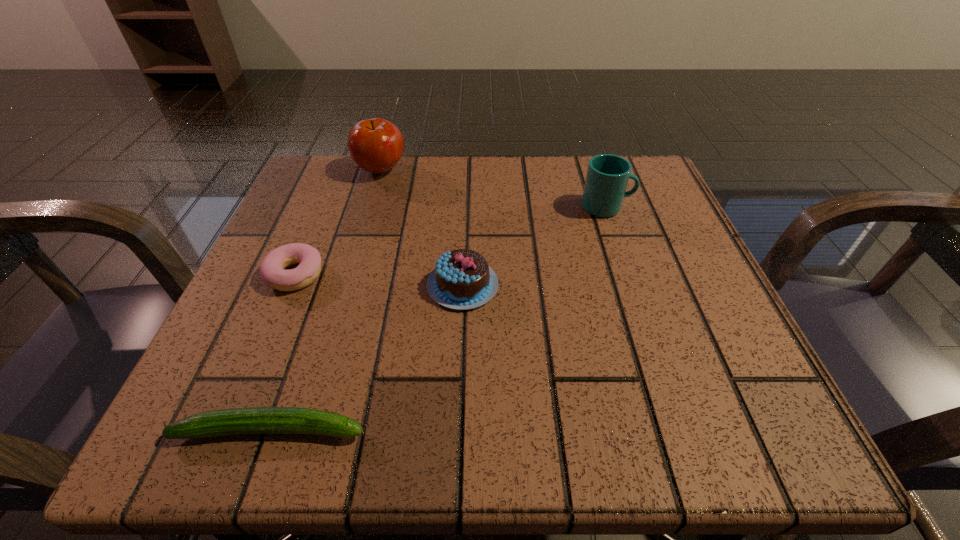
You are a GUI agent. You are given a task and a screenshot of the screen. Output one action in this format:
    pyautogui.click(x=<x>, y=<y>)
    Task: Click on the vacant space situated 0.080m on the handle side of the fourth shortest object
    The height and width of the screenshot is (540, 960).
    Given the screenshot: What is the action you would take?
    pyautogui.click(x=674, y=207)

Image resolution: width=960 pixels, height=540 pixels. I want to click on vacant space located on the right of the third shortest object, so 541,285.

Locate an element on the screen. The image size is (960, 540). free location located 0.100m on the back of the doughnut is located at coordinates (318, 220).

At what (x,y) coordinates should I click in order to perform the action: click on vacant space situated on the front-facing side of the nearest object. Please return your answer as a coordinate pair (x, y). The image size is (960, 540). Looking at the image, I should click on tap(628, 430).

The image size is (960, 540). Identify the location of apple at the far edge. pyautogui.click(x=376, y=145).

At what (x,y) coordinates should I click in order to perform the action: click on cup situated at the far edge. Please return your answer as a coordinate pair (x, y). The width and height of the screenshot is (960, 540). Looking at the image, I should click on (607, 176).

At what (x,y) coordinates should I click in order to perform the action: click on object situated at the near edge. Please return your answer as a coordinate pair (x, y). This screenshot has height=540, width=960. Looking at the image, I should click on (255, 420).

Locate an element on the screen. apple that is at the left edge is located at coordinates (376, 145).

The image size is (960, 540). Find the location of `doughnut present at the left edge`. doughnut present at the left edge is located at coordinates (272, 271).

Find the location of `zucchini that is at the left edge`. zucchini that is at the left edge is located at coordinates (255, 420).